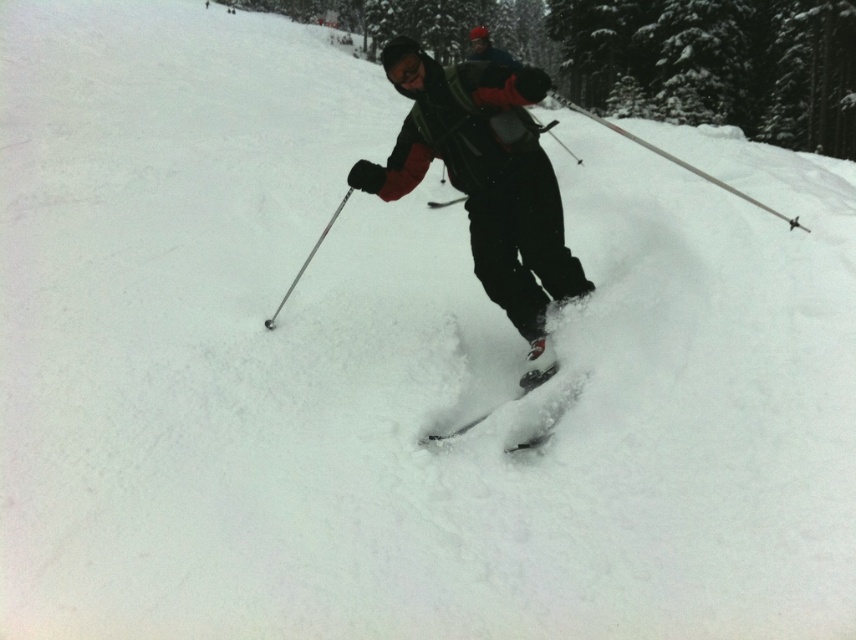
Question: In this image, where is green textured tree at center located relative to matte black ski suit at center?

Choices:
 (A) left
 (B) right

Answer: (B)

Question: Which object appears closest to the camera in this image?

Choices:
 (A) shiny black ski at center
 (B) metallic silver ski pole at center
 (C) matte black ski suit at center

Answer: (C)

Question: Which object appears closest to the camera in this image?

Choices:
 (A) metallic silver ski pole at center
 (B) shiny black ski at center
 (C) green textured tree at center

Answer: (B)

Question: Which object is the farthest from the metallic silver ski pole at center?

Choices:
 (A) green textured tree at center
 (B) shiny black ski at center

Answer: (A)

Question: From the image, what is the correct spatial relationship of matte black ski suit at center in relation to shiny black ski at center?

Choices:
 (A) left
 (B) right

Answer: (B)

Question: Can you confirm if green textured tree at center is wider than matte black ski suit at center?

Choices:
 (A) yes
 (B) no

Answer: (A)